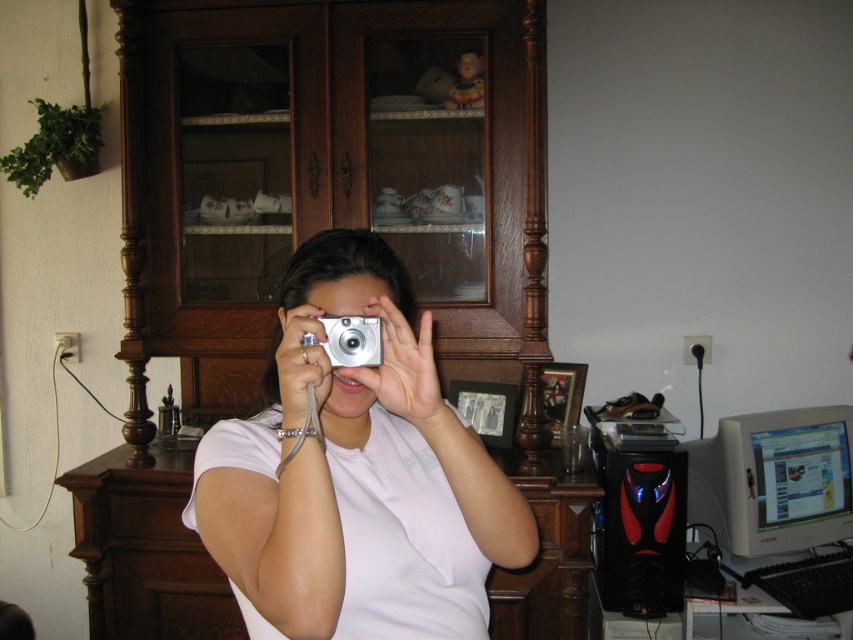
Question: Which point appears farthest from the camera in this image?

Choices:
 (A) (462, 573)
 (B) (776, 476)
 (C) (370, 342)

Answer: (B)

Question: Can you confirm if matte silver camera at center is positioned to the left of silver metallic camera at center?

Choices:
 (A) yes
 (B) no

Answer: (B)

Question: Can you confirm if matte silver camera at center is positioned to the left of silver metallic camera at center?

Choices:
 (A) yes
 (B) no

Answer: (B)

Question: Is matte silver camera at center positioned in front of black plastic monitor at right?

Choices:
 (A) yes
 (B) no

Answer: (A)

Question: Which object is positioned farthest from the black plastic monitor at right?

Choices:
 (A) matte silver camera at center
 (B) silver metallic camera at center

Answer: (B)

Question: Which point is closer to the camera taking this photo?

Choices:
 (A) (720, 502)
 (B) (338, 346)

Answer: (B)